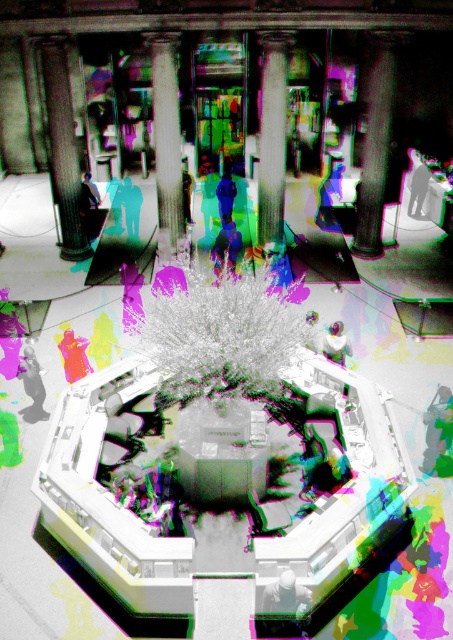
You are a delivery person carrying a large box that is 3 meters long. You need to navigate through the space between the smooth gray column at upper left and the smooth white pillar at center. Can your box fit through the gap between them without bending or breaking the box?

The gap between the smooth gray column at upper left and the smooth white pillar at center is 3.54 meters. Since the box is 3 meters long, it can fit through the gap as the distance is sufficient to accommodate the box without bending or breaking it.

Consider the image. You are an architect reviewing this design. You notice the smooth gray column at upper left and the smooth white pillar at center. Which one is positioned further away from the viewer?

The smooth white pillar at center is positioned further away from the viewer than the smooth gray column at upper left because it is described as being behind it.

You are standing in the middle of the room and want to touch both the white fluffy tree at center and the smooth gray column at right. Which object should you reach for first to touch the closest one?

You should reach for the white fluffy tree at center first because it is closer to you than the smooth gray column at right.